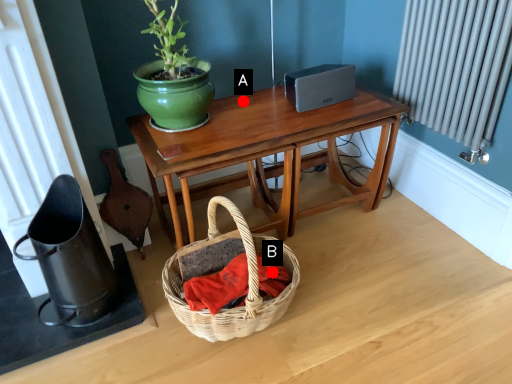
Question: Two points are circled on the image, labeled by A and B beside each circle. Which point is closer to the camera taking this photo?

Choices:
 (A) A is closer
 (B) B is closer

Answer: (B)